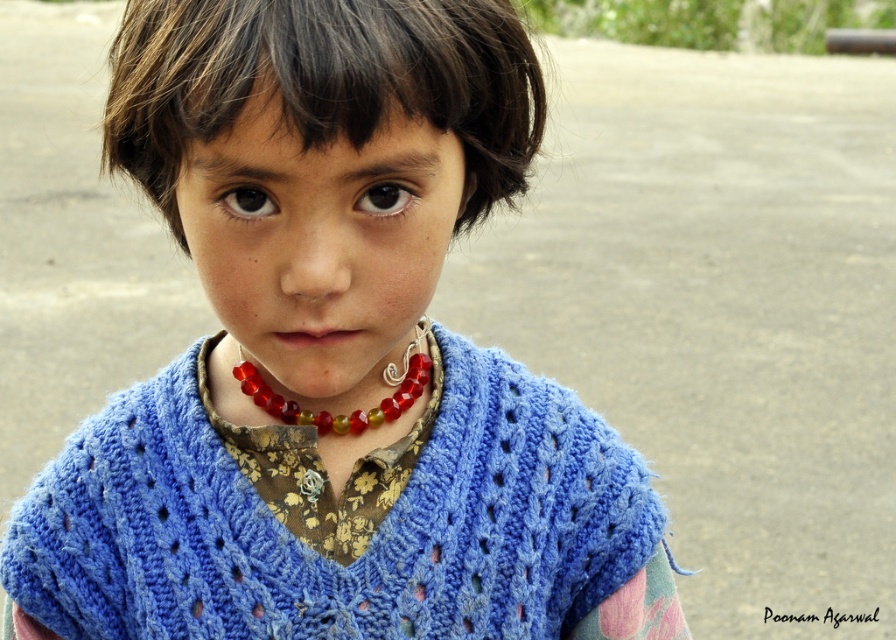
What is the exact 2D coordinate position of the blue knitted shawl at center in the image?

The blue knitted shawl at center is located at the 2D coordinate point of (342,518).

What is located at the point with coordinates (342,518) in the image?

The point at coordinates (342,518) indicates the location of the blue knitted shawl at center.

You are a photographer adjusting the focus of your camera. You notice two points in the image at coordinates point [666,564] and point [246,362]. Which point is closer to the camera lens?

Point [666,564] is further to the viewer than point [246,362], so the point closer to the camera lens is point [246,362].